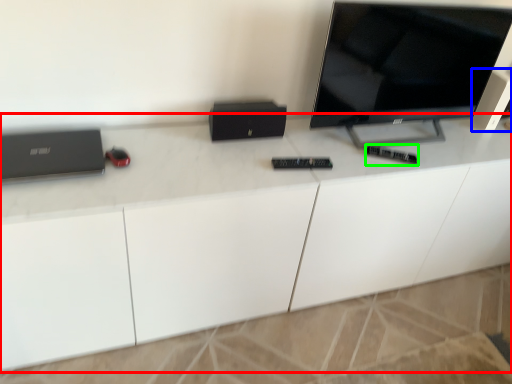
Question: Estimate the real-world distances between objects in this image. Which object is farther from desk (highlighted by a red box), speaker (highlighted by a blue box) or control (highlighted by a green box)?

Choices:
 (A) speaker
 (B) control

Answer: (A)